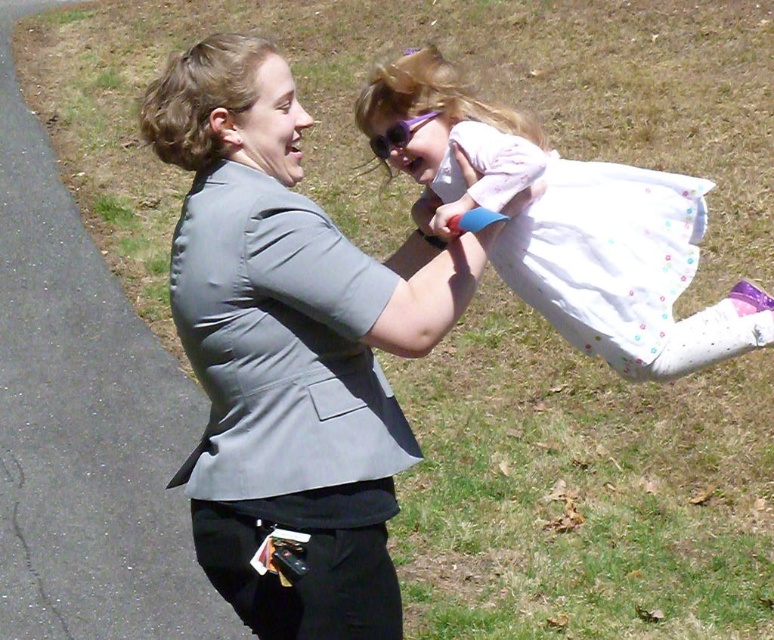
You are a photographer trying to capture a clear photo of the purple plastic goggles at upper center. However, the white dotted dress at center is blocking your view. Can you move the dress to get a clear shot of the goggles?

The white dotted dress at center is in front of the purple plastic goggles at upper center, so you need to move the dress to capture the goggles clearly.

You are a photographer trying to capture a candid shot of the adult and child interaction. Given that the gray fabric jacket at center and purple plastic goggles at upper center are in the frame, which object would you focus on first if you want to emphasize the adult in your composition?

The gray fabric jacket at center should be focused on first because it has a greater height compared to the purple plastic goggles at upper center, making it more prominent in the composition.